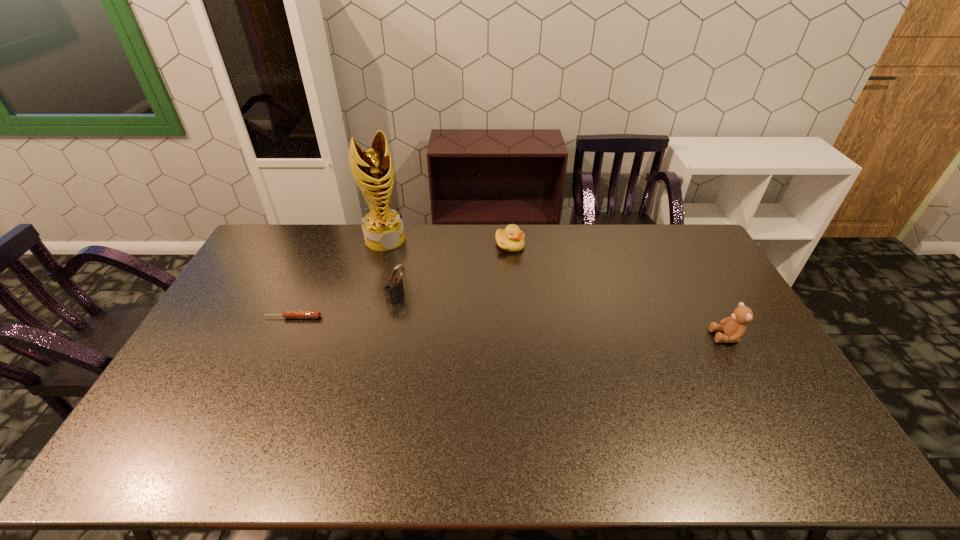
Image resolution: width=960 pixels, height=540 pixels. Identify the location of free spot that satisfies the following two spatial constraints: 1. on the front side of the award; 2. on the face of the rightmost object. (358, 336).

At what (x,y) coordinates should I click in order to perform the action: click on vacant area that satisfies the following two spatial constraints: 1. on the back side of the fourth farthest object; 2. on the right side of the tallest object. Please return your answer as a coordinate pair (x, y). Looking at the image, I should click on (327, 239).

You are a GUI agent. You are given a task and a screenshot of the screen. Output one action in this format:
    pyautogui.click(x=<x>, y=<y>)
    Task: Click on the free location that satisfies the following two spatial constraints: 1. on the front side of the sausage; 2. on the face of the rightmost object
    
    Given the screenshot: What is the action you would take?
    pyautogui.click(x=285, y=336)

The width and height of the screenshot is (960, 540). I want to click on vacant space that satisfies the following two spatial constraints: 1. on the front side of the fourth object from left to right; 2. on the face of the teddy bear, so click(x=517, y=336).